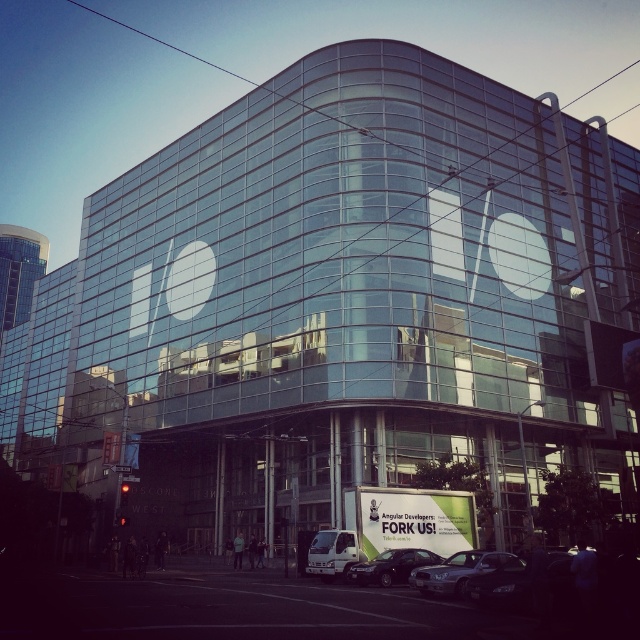
You are a pedestrian standing on the sidewalk in front of the modern glass building. You see a shiny black sedan at lower center and a white metallic van at center. Which vehicle is closer to you?

The shiny black sedan at lower center is closer to you because it is in front of the white metallic van at center.

You are a pedestrian standing on the sidewalk in front of the modern glass building. You see two sedans at center. Which sedan is closer to you, the metallic silver sedan at center or the shiny black sedan at center?

The metallic silver sedan at center is closer to you because it is located above the shiny black sedan at center, indicating it is in a more forward position in the image.